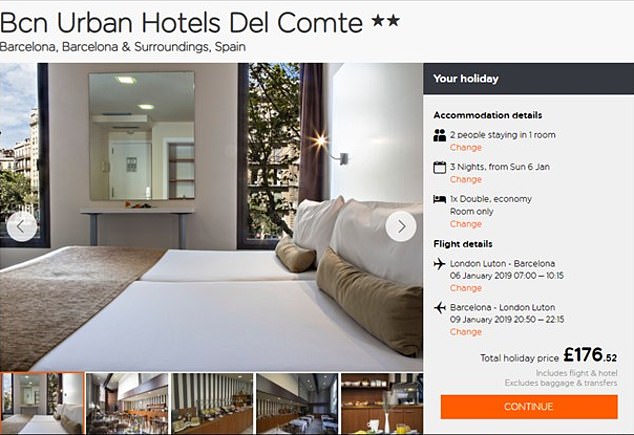
The width and height of the screenshot is (634, 435). Find the location of `mirror with door in view`. mirror with door in view is located at coordinates (141, 148).